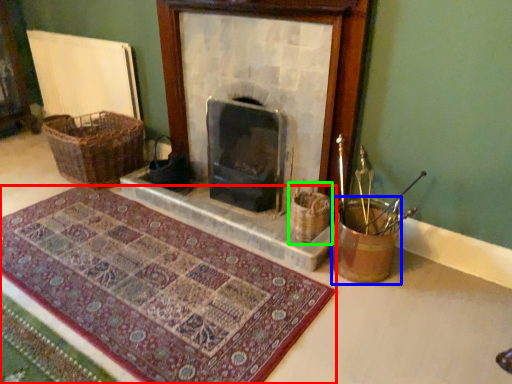
Question: Based on their relative distances, which object is farther from mat (highlighted by a red box)? Choose from basket container (highlighted by a blue box) and basket (highlighted by a green box).

Choices:
 (A) basket container
 (B) basket

Answer: (B)